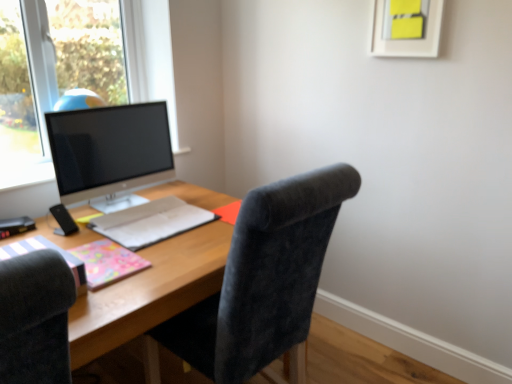
Locate an element on the screen. free space above matte gray notebook at center, which ranks as the third notebook in front-to-back order (from a real-world perspective) is located at coordinates [156, 215].